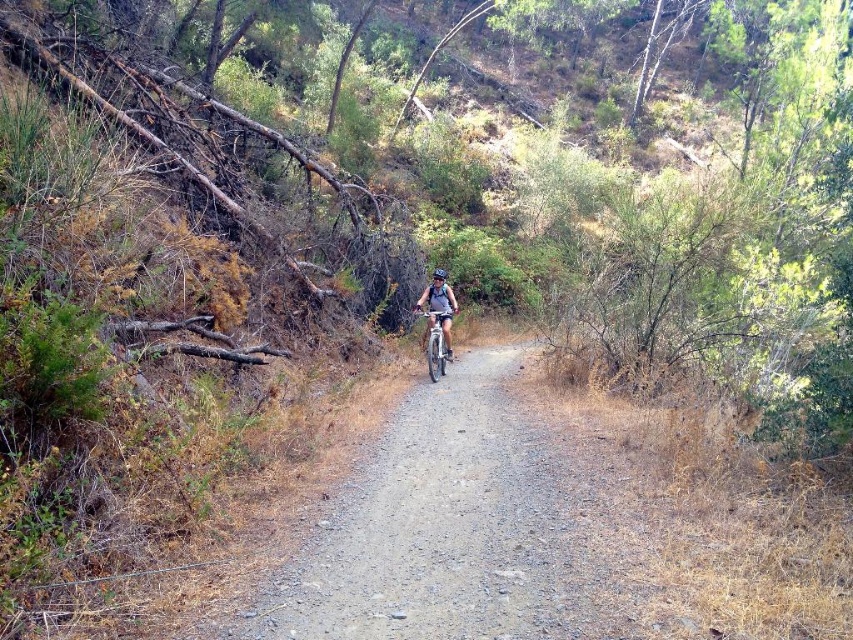
You are standing at the starting point of the gravel path in the woods. You see two points marked on the path ahead of you. The first point is at coordinates point (585, 584) and the second is at point (432, 320). Which of these points is closer to you?

Point (585, 584) is closer to the camera than point (432, 320). Therefore, the point at coordinates point (585, 584) is closer to you.